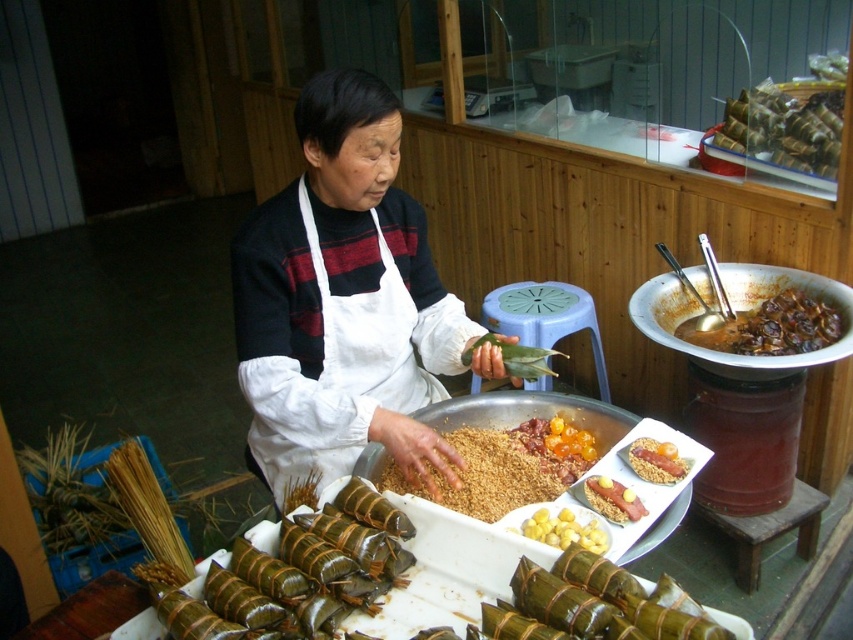
Which is behind, point (218, 593) or point (543, 433)?

Point (543, 433)

Locate an element on the screen. green bamboo leaves at lower left is located at coordinates (299, 573).

Does white fabric apron at center appear on the right side of green leafy wrapped dumplings at lower center?

Incorrect, white fabric apron at center is not on the right side of green leafy wrapped dumplings at lower center.

Is white fabric apron at center closer to the viewer compared to green leafy wrapped dumplings at lower center?

That is False.

Measure the distance between point (296,131) and camera.

They are 5.62 feet apart.

Locate an element on the screen. white fabric apron at center is located at coordinates (341, 300).

Between golden crispy bacon at center and green leafy food at center, which one has less height?

golden crispy bacon at center

Can you confirm if golden crispy bacon at center is shorter than green leafy food at center?

Yes, golden crispy bacon at center is shorter than green leafy food at center.

What do you see at coordinates (654, 460) in the screenshot? The width and height of the screenshot is (853, 640). I see `golden crispy bacon at center` at bounding box center [654, 460].

You are a GUI agent. You are given a task and a screenshot of the screen. Output one action in this format:
    pyautogui.click(x=<x>, y=<y>)
    Task: Click on the golden crispy bacon at center
    The image size is (853, 640).
    Given the screenshot: What is the action you would take?
    pyautogui.click(x=654, y=460)